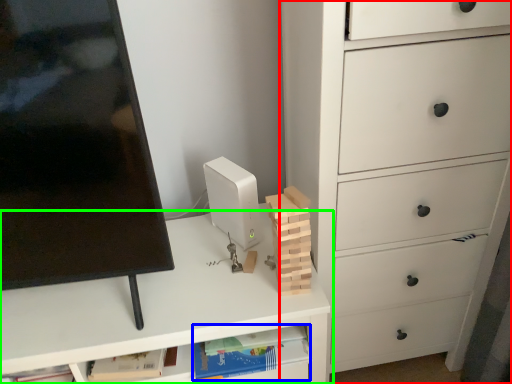
Question: Which is farther away from chest of drawers (highlighted by a red box)? book (highlighted by a blue box) or desk (highlighted by a green box)?

Choices:
 (A) book
 (B) desk

Answer: (A)